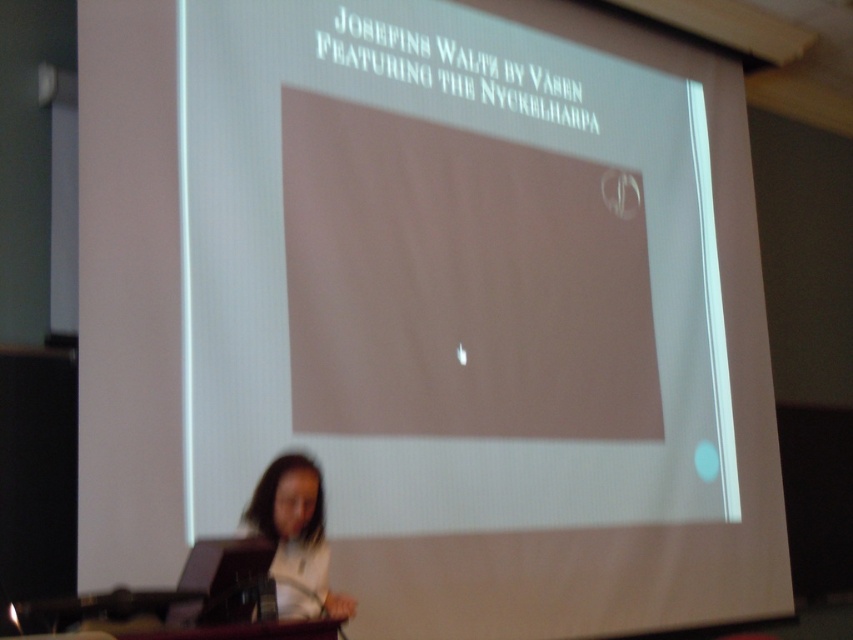
You are an event coordinator setting up for a presentation. You need to adjust the lighting so that the white matte projection screen at center and the white matte hair at lower left are both visible. Which object should you position closer to the light source to ensure both are properly lit?

The white matte projection screen at center should be positioned closer to the light source because it is to the right of the white matte hair at lower left, and adjusting its position can help balance the lighting between both objects.

You are an event planner setting up for a presentation. You need to place a 1.2 meter wide banner between the white matte projection screen at center and the white matte hair at lower left. Can the banner fit horizontally between them?

The white matte projection screen at center is wider than the white matte hair at lower left. Since the banner is 1.2 meters wide, it might fit if the distance between them is sufficient. However, the description only mentions the width comparison between the objects, not the distance between them. Without knowing the actual spacing, it is impossible to determine if the banner will fit horizontally.

You are an event planner setting up for a presentation. You notice the white matte projection screen at center and the white matte hair at lower left. Which object is located higher in the image?

The white matte projection screen at center is positioned over the white matte hair at lower left, meaning it is higher up in the image.